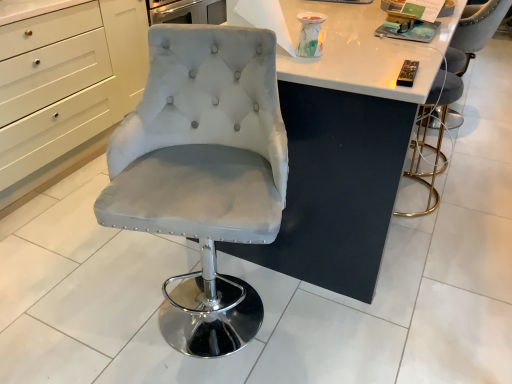
Question: From a real-world perspective, relative to metallic gold bar stool at right, the 2th chair viewed from the right, is black plastic remote control at upper right, the first magazine positioned from the bottom, vertically above or below?

Choices:
 (A) below
 (B) above

Answer: (B)

Question: Is black plastic remote control at upper right, positioned as the 1th magazine in front-to-back order, bigger or smaller than metallic gold bar stool at right, arranged as the 2th chair when viewed from the left?

Choices:
 (A) big
 (B) small

Answer: (B)

Question: Considering the real-world distances, which object is farthest from the black plastic remote control at upper right, arranged as the second magazine when viewed from the top?

Choices:
 (A) velvet grey chair at right, the first chair viewed from the right
 (B) matte gray magazine at upper right, marked as the second magazine in a front-to-back arrangement
 (C) satin white chair at center, arranged as the first chair when viewed from the front
 (D) metallic gold bar stool at right, the 2th chair viewed from the right
 (E) white matte cabinet at left

Answer: (E)

Question: Which object is the closest to the satin white chair at center, arranged as the 3th chair when viewed from the back?

Choices:
 (A) metallic gold bar stool at right, arranged as the 2th chair when viewed from the left
 (B) velvet grey chair at right, acting as the third chair starting from the left
 (C) matte gray magazine at upper right, the first magazine viewed from the back
 (D) black plastic remote control at upper right, arranged as the 2th magazine when viewed from the back
 (E) white matte cabinet at left

Answer: (D)